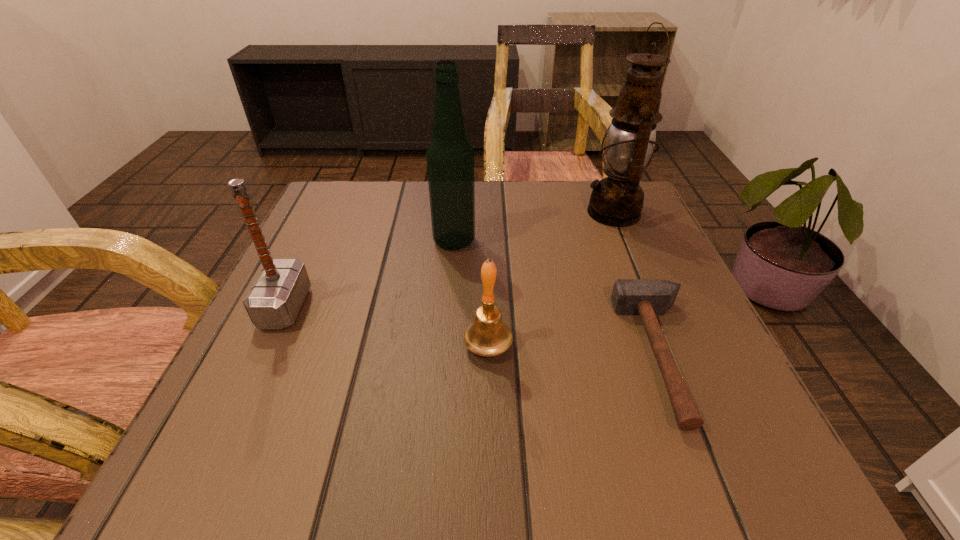
Where is `vacant space located 0.120m on the left of the second shortest object`? Image resolution: width=960 pixels, height=540 pixels. vacant space located 0.120m on the left of the second shortest object is located at coordinates (390, 346).

The image size is (960, 540). Find the location of `blank space located 0.160m on the striking surface of the shortest object`. blank space located 0.160m on the striking surface of the shortest object is located at coordinates (527, 356).

Find the location of a particular element. The height and width of the screenshot is (540, 960). free space located on the striking surface of the shortest object is located at coordinates (540, 356).

Find the location of `vacant space located 0.280m on the striking surface of the shortest object`. vacant space located 0.280m on the striking surface of the shortest object is located at coordinates (452, 356).

Identify the location of oil lamp that is at the far edge. click(x=617, y=200).

The image size is (960, 540). What are the coordinates of `alcohol present at the far edge` in the screenshot? It's located at (450, 157).

Where is `object at the near edge`? The image size is (960, 540). object at the near edge is located at coordinates (646, 297).

Where is `object that is positioned at the left edge`? The height and width of the screenshot is (540, 960). object that is positioned at the left edge is located at coordinates (274, 300).

The image size is (960, 540). I want to click on oil lamp that is at the right edge, so click(x=617, y=200).

Identify the location of hammer positioned at the right edge. The image size is (960, 540). (646, 297).